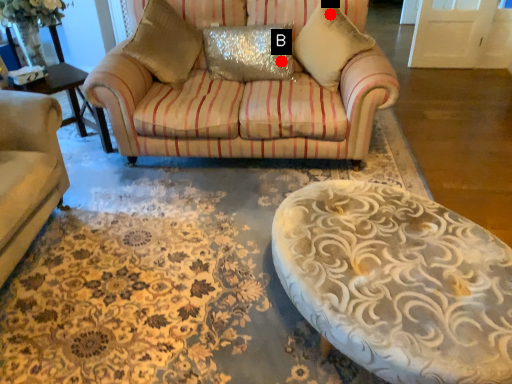
Question: Two points are circled on the image, labeled by A and B beside each circle. Which point is closer to the camera taking this photo?

Choices:
 (A) A is closer
 (B) B is closer

Answer: (A)